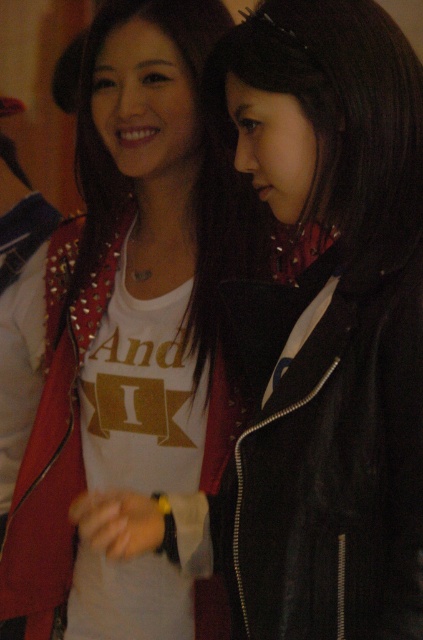
Question: In this image, where is matte studded jacket at center located relative to black leather jacket at center?

Choices:
 (A) right
 (B) left

Answer: (B)

Question: Which of the following is the closest to the observer?

Choices:
 (A) (85, 221)
 (B) (406, 333)

Answer: (B)

Question: Which of the following is the farthest from the observer?

Choices:
 (A) click(406, 372)
 (B) click(140, 13)
 (C) click(84, 145)

Answer: (C)

Question: Which of these objects is positioned farthest from the matte studded jacket at center?

Choices:
 (A) studded leather jacket at center
 (B) black leather jacket at center

Answer: (B)

Question: Is black leather jacket at center above studded leather jacket at center?

Choices:
 (A) no
 (B) yes

Answer: (A)

Question: Considering the relative positions of matte studded jacket at center and studded leather jacket at center in the image provided, where is matte studded jacket at center located with respect to studded leather jacket at center?

Choices:
 (A) right
 (B) left

Answer: (B)